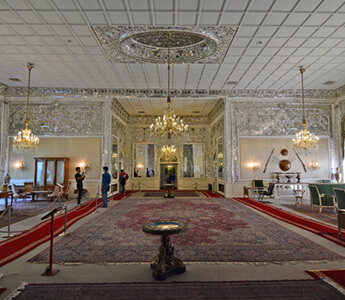
Find the location of a particular element. The width and height of the screenshot is (345, 300). wooden case is located at coordinates (55, 167).